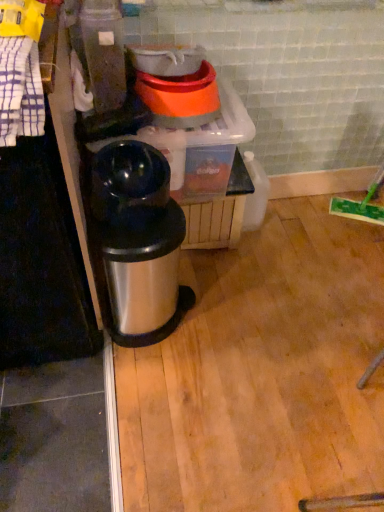
Describe the element at coordinates (180, 97) in the screenshot. I see `orange plastic bowls at upper center, which ranks as the 1th appliance in top-to-bottom order` at that location.

Locate an element on the screen. The height and width of the screenshot is (512, 384). white checkered towel at left is located at coordinates (20, 91).

From a real-world perspective, is orange plastic bowls at upper center, which ranks as the 1th appliance in top-to-bottom order, physically above white checkered towel at left?

No, from a real-world perspective, orange plastic bowls at upper center, which ranks as the 1th appliance in top-to-bottom order, is not over white checkered towel at left

Is orange plastic bowls at upper center, placed as the 2th appliance when sorted from bottom to top, wider than white checkered towel at left?

Yes, orange plastic bowls at upper center, placed as the 2th appliance when sorted from bottom to top, is wider than white checkered towel at left.

Which is in front, point (152, 91) or point (30, 42)?

Positioned in front is point (30, 42).

Does orange plastic bowls at upper center, which ranks as the 1th appliance in top-to-bottom order, have a smaller size compared to white checkered towel at left?

Incorrect, orange plastic bowls at upper center, which ranks as the 1th appliance in top-to-bottom order, is not smaller in size than white checkered towel at left.

In order to click on appliance lying on the right of shiny black thermos at center, the first appliance positioned from the bottom in this screenshot , I will do `click(180, 97)`.

Between orange plastic bowls at upper center, placed as the 2th appliance when sorted from bottom to top, and shiny black thermos at center, the second appliance in the top-to-bottom sequence, which one has less height?

With less height is orange plastic bowls at upper center, placed as the 2th appliance when sorted from bottom to top.

Consider the image. Considering the relative sizes of orange plastic bowls at upper center, which ranks as the 1th appliance in top-to-bottom order, and shiny black thermos at center, the first appliance positioned from the bottom, in the image provided, is orange plastic bowls at upper center, which ranks as the 1th appliance in top-to-bottom order, smaller than shiny black thermos at center, the first appliance positioned from the bottom,?

Yes.

Consider the image. Would you say orange plastic bowls at upper center, placed as the 2th appliance when sorted from bottom to top, is a long distance from shiny black thermos at center, the second appliance in the top-to-bottom sequence?

Result: That's not correct — orange plastic bowls at upper center, placed as the 2th appliance when sorted from bottom to top, is a little close to shiny black thermos at center, the second appliance in the top-to-bottom sequence.

From a real-world perspective, is shiny black thermos at center, the second appliance in the top-to-bottom sequence, under orange plastic bowls at upper center, placed as the 2th appliance when sorted from bottom to top?

Indeed, from a real-world perspective, shiny black thermos at center, the second appliance in the top-to-bottom sequence, is positioned beneath orange plastic bowls at upper center, placed as the 2th appliance when sorted from bottom to top.

Between point (142, 193) and point (199, 118), which one is positioned in front?

The point (142, 193) is closer to the camera.

Is shiny metallic trash can at center further to camera compared to white checkered towel at left?

Yes, it is behind white checkered towel at left.

Is shiny metallic trash can at center facing towards white checkered towel at left?

No, shiny metallic trash can at center is not oriented towards white checkered towel at left.

Does shiny metallic trash can at center have a greater height compared to white checkered towel at left?

Yes.

Does shiny metallic trash can at center have a lesser width compared to white checkered towel at left?

No, shiny metallic trash can at center is not thinner than white checkered towel at left.

Considering the sizes of objects shiny metallic trash can at center and orange plastic bowls at upper center, which ranks as the 1th appliance in top-to-bottom order, in the image provided, who is taller, shiny metallic trash can at center or orange plastic bowls at upper center, which ranks as the 1th appliance in top-to-bottom order,?

shiny metallic trash can at center is taller.

From a real-world perspective, is shiny metallic trash can at center above or below orange plastic bowls at upper center, placed as the 2th appliance when sorted from bottom to top?

In terms of real-world spatial position, shiny metallic trash can at center is below orange plastic bowls at upper center, placed as the 2th appliance when sorted from bottom to top.

Does point (116, 326) appear closer or farther from the camera than point (202, 60)?

Point (116, 326).

Who is smaller, shiny metallic trash can at center or orange plastic bowls at upper center, placed as the 2th appliance when sorted from bottom to top?

orange plastic bowls at upper center, placed as the 2th appliance when sorted from bottom to top.

Considering the positions of objects white checkered towel at left and shiny metallic trash can at center in the image provided, who is more to the right, white checkered towel at left or shiny metallic trash can at center?

From the viewer's perspective, shiny metallic trash can at center appears more on the right side.

From a real-world perspective, which object rests below the other?

From a 3D spatial view, shiny metallic trash can at center is below.

Is white checkered towel at left facing away from shiny metallic trash can at center?

No, shiny metallic trash can at center is not at the back of white checkered towel at left.

In the scene shown: How far apart are white checkered towel at left and shiny metallic trash can at center?

48.68 centimeters.

Is shiny metallic trash can at center shorter than shiny black thermos at center, the second appliance in the top-to-bottom sequence?

No, shiny metallic trash can at center is not shorter than shiny black thermos at center, the second appliance in the top-to-bottom sequence.

Looking at this image, who is smaller, shiny metallic trash can at center or shiny black thermos at center, the second appliance in the top-to-bottom sequence?

With smaller size is shiny black thermos at center, the second appliance in the top-to-bottom sequence.

Which object is more forward, shiny metallic trash can at center or shiny black thermos at center, the second appliance in the top-to-bottom sequence?

shiny black thermos at center, the second appliance in the top-to-bottom sequence, is closer to the camera.

Consider the image. Are shiny metallic trash can at center and shiny black thermos at center, the second appliance in the top-to-bottom sequence, located far from each other?

No, shiny metallic trash can at center is not far from shiny black thermos at center, the second appliance in the top-to-bottom sequence.

The image size is (384, 512). What are the coordinates of `laundry to the left of orange plastic bowls at upper center, which ranks as the 1th appliance in top-to-bottom order` in the screenshot? It's located at (20, 91).

At what (x,y) coordinates should I click in order to perform the action: click on appliance located underneath the orange plastic bowls at upper center, placed as the 2th appliance when sorted from bottom to top (from a real-world perspective). Please return your answer as a coordinate pair (x, y). The width and height of the screenshot is (384, 512). Looking at the image, I should click on click(128, 184).

Based on the photo, looking at the image, which one is located closer to white checkered towel at left, shiny black thermos at center, the first appliance positioned from the bottom, or shiny metallic trash can at center?

shiny black thermos at center, the first appliance positioned from the bottom, is closer to white checkered towel at left.

Looking at the image, which one is located further to orange plastic bowls at upper center, placed as the 2th appliance when sorted from bottom to top, white checkered towel at left or shiny metallic trash can at center?

white checkered towel at left is further to orange plastic bowls at upper center, placed as the 2th appliance when sorted from bottom to top.

Estimate the real-world distances between objects in this image. Which object is closer to shiny metallic trash can at center, orange plastic bowls at upper center, which ranks as the 1th appliance in top-to-bottom order, or shiny black thermos at center, the second appliance in the top-to-bottom sequence?

shiny black thermos at center, the second appliance in the top-to-bottom sequence.

Looking at the image, which one is located further to white checkered towel at left, shiny metallic trash can at center or shiny black thermos at center, the first appliance positioned from the bottom?

shiny metallic trash can at center is positioned further to the anchor white checkered towel at left.

From the image, which object appears to be farther from shiny black thermos at center, the first appliance positioned from the bottom, white checkered towel at left or shiny metallic trash can at center?

white checkered towel at left.

Which object lies nearer to the anchor point white checkered towel at left, orange plastic bowls at upper center, which ranks as the 1th appliance in top-to-bottom order, or shiny metallic trash can at center?

The object closer to white checkered towel at left is shiny metallic trash can at center.

Estimate the real-world distances between objects in this image. Which object is further from white checkered towel at left, shiny metallic trash can at center or orange plastic bowls at upper center, which ranks as the 1th appliance in top-to-bottom order?

Answer: The object further to white checkered towel at left is orange plastic bowls at upper center, which ranks as the 1th appliance in top-to-bottom order.

Estimate the real-world distances between objects in this image. Which object is further from shiny black thermos at center, the first appliance positioned from the bottom, orange plastic bowls at upper center, placed as the 2th appliance when sorted from bottom to top, or white checkered towel at left?

The object further to shiny black thermos at center, the first appliance positioned from the bottom, is white checkered towel at left.

In order to click on appliance between white checkered towel at left and orange plastic bowls at upper center, which ranks as the 1th appliance in top-to-bottom order, along the z-axis in this screenshot , I will do `click(128, 184)`.

Locate an element on the screen. The image size is (384, 512). appliance located between white checkered towel at left and shiny metallic trash can at center in the depth direction is located at coordinates (128, 184).

The image size is (384, 512). Find the location of `laundry between orange plastic bowls at upper center, placed as the 2th appliance when sorted from bottom to top, and shiny metallic trash can at center vertically`. laundry between orange plastic bowls at upper center, placed as the 2th appliance when sorted from bottom to top, and shiny metallic trash can at center vertically is located at coordinates (20, 91).

Locate an element on the screen. The height and width of the screenshot is (512, 384). appliance between orange plastic bowls at upper center, which ranks as the 1th appliance in top-to-bottom order, and shiny metallic trash can at center from top to bottom is located at coordinates (128, 184).